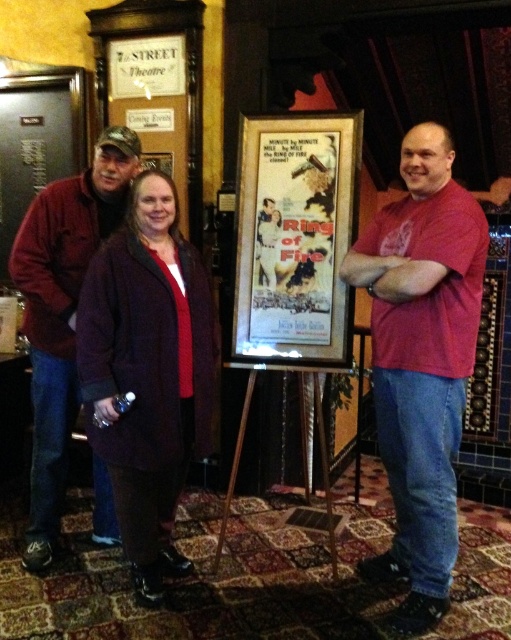
Question: Which object is farther from the camera taking this photo?

Choices:
 (A) vintage paper poster at center
 (B) dark purple wool coat at center
 (C) maroon fleece jacket at center
 (D) red matte shirt at center

Answer: (A)

Question: Is red matte shirt at center bigger than maroon fleece jacket at center?

Choices:
 (A) no
 (B) yes

Answer: (B)

Question: Which of the following is the farthest from the observer?

Choices:
 (A) vintage paper poster at center
 (B) maroon fleece jacket at center

Answer: (A)

Question: Among these points, which one is nearest to the camera?

Choices:
 (A) (461, 196)
 (B) (207, 342)

Answer: (A)

Question: Is maroon fleece jacket at center in front of vintage paper poster at center?

Choices:
 (A) no
 (B) yes

Answer: (B)

Question: From the image, what is the correct spatial relationship of red matte shirt at center in relation to maroon fleece jacket at center?

Choices:
 (A) left
 (B) right

Answer: (B)